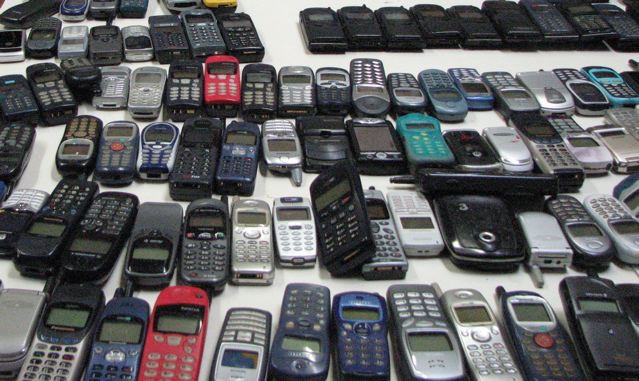
Locate an element on the screen. The width and height of the screenshot is (639, 381). display is located at coordinates (124, 333).